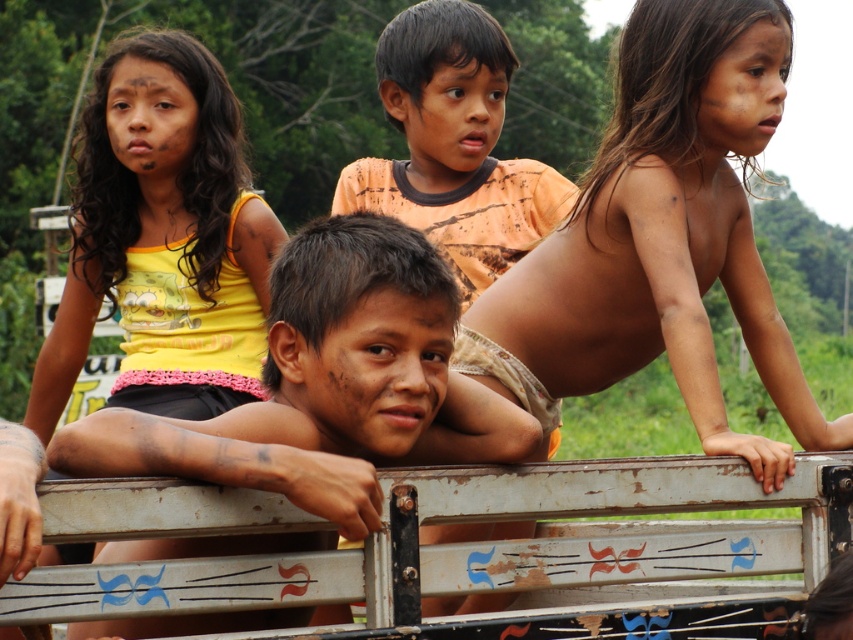
Looking at this image, is yellow printed tank top at upper left shorter than orange t-shirt at center?

No.

Which is in front, point (212, 388) or point (416, 200)?

Point (212, 388) is in front.

The width and height of the screenshot is (853, 640). What are the coordinates of `yellow printed tank top at upper left` in the screenshot? It's located at coord(161,237).

Between smooth skin girl at upper right and dark brown hair at center, which one appears on the left side from the viewer's perspective?

Positioned to the left is dark brown hair at center.

Does smooth skin girl at upper right have a larger size compared to dark brown hair at center?

Indeed, smooth skin girl at upper right has a larger size compared to dark brown hair at center.

Does point (730, 272) lie in front of point (409, 362)?

No.

Locate an element on the screen. smooth skin girl at upper right is located at coordinates (662, 237).

Which of these two, metallic painted rail at center or yellow printed tank top at upper left, stands shorter?

metallic painted rail at center

At what (x,y) coordinates should I click in order to perform the action: click on metallic painted rail at center. Please return your answer as a coordinate pair (x, y). Looking at the image, I should click on (621, 528).

The width and height of the screenshot is (853, 640). What do you see at coordinates (621, 528) in the screenshot?
I see `metallic painted rail at center` at bounding box center [621, 528].

Image resolution: width=853 pixels, height=640 pixels. Find the location of `metallic painted rail at center`. metallic painted rail at center is located at coordinates (621, 528).